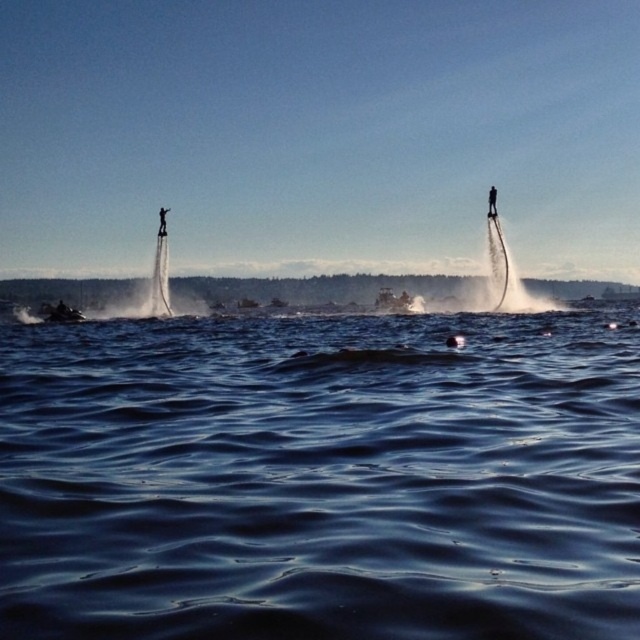
Is dark blue water at center behind black matte flyboard at upper right?

No.

Between dark blue water at center and black matte flyboard at upper right, which one has more height?

With more height is dark blue water at center.

The image size is (640, 640). What are the coordinates of `dark blue water at center` in the screenshot? It's located at (321, 476).

Does brushed metal jet ski at lower left appear on the right side of black matte flyboard at upper right?

In fact, brushed metal jet ski at lower left is to the left of black matte flyboard at upper right.

Is brushed metal jet ski at lower left above black matte flyboard at upper right?

No, brushed metal jet ski at lower left is not above black matte flyboard at upper right.

Is point (45, 307) farther from viewer compared to point (496, 196)?

Yes, it is.

Identify the location of brushed metal jet ski at lower left. coord(60,312).

In the scene shown: Between dark blue water at center and black matte jetpack at left, which one has more height?

Standing taller between the two is dark blue water at center.

Which is more to the right, dark blue water at center or black matte jetpack at left?

dark blue water at center is more to the right.

Which is in front, point (284, 416) or point (163, 232)?

Point (284, 416) is in front.

This screenshot has height=640, width=640. I want to click on dark blue water at center, so click(x=321, y=476).